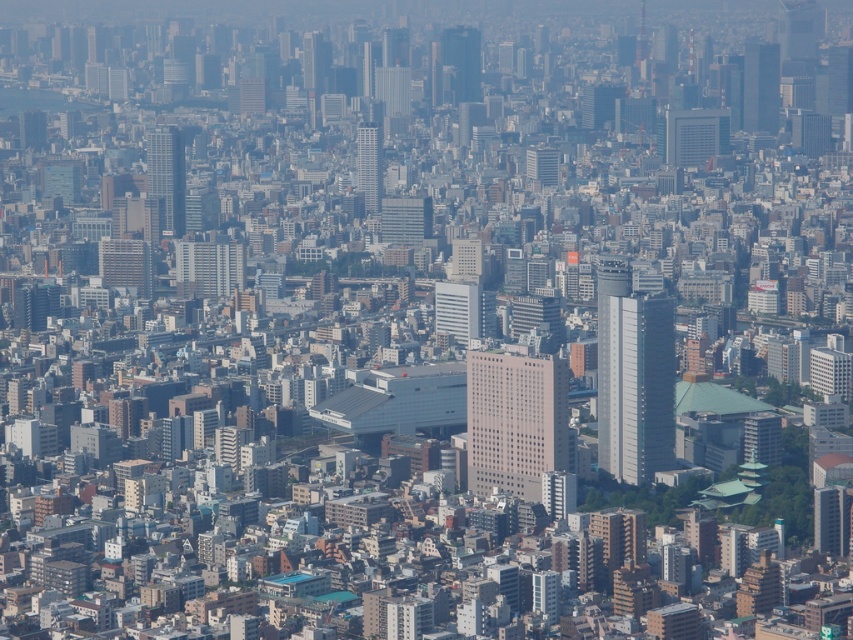
You are a city planner assessing the space between the beige concrete building at center and the silver glass skyscraper at center. Given that the minimum required distance for a new pedestrian walkway is 15 meters, can the walkway be constructed between them?

The beige concrete building at center and the silver glass skyscraper at center are 17.74 meters apart, which exceeds the 15 meter requirement. Therefore, the pedestrian walkway can be constructed between them.

In the scene shown: You are a drone operator flying over the city. You have two points marked on your map. The first point is at coordinate point (664, 397) and the second point is at coordinate point (456, 64). You need to determine which point is closer to your current position at the camera. Which point is closer?

Point (664, 397) is closer to the camera than point (456, 64).

You are a drone operator tasked with flying a drone between two skyscrapers in the city. The drone has a maximum flight distance of 60 meters. Given the metallic glass skyscraper at upper center and the smooth glass skyscraper at upper center, can the drone safely fly between them without exceeding its range?

The metallic glass skyscraper at upper center and smooth glass skyscraper at upper center are 66.37 meters apart from each other. Since the drone has a maximum flight distance of 60 meters, it cannot safely fly between them without exceeding its range.